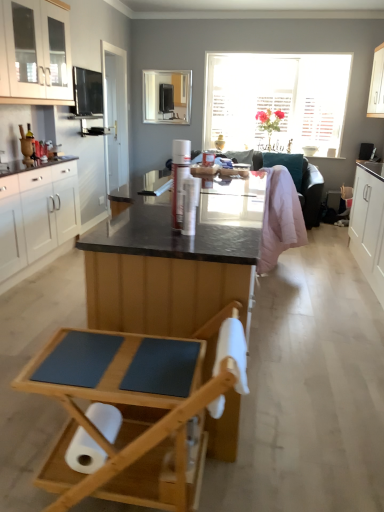
Question: Does white glossy cabinet at upper right, which is the fourth cabinetry from left to right, have a greater height compared to teal fabric couch at center?

Choices:
 (A) yes
 (B) no

Answer: (B)

Question: Is white glossy cabinet at upper right, which is the fourth cabinetry from left to right, at the right side of teal fabric couch at center?

Choices:
 (A) no
 (B) yes

Answer: (B)

Question: Is white glossy cabinet at upper right, the first cabinetry from the right, bigger than teal fabric couch at center?

Choices:
 (A) yes
 (B) no

Answer: (B)

Question: Is white glossy cabinet at upper right, which is the fourth cabinetry from left to right, not close to teal fabric couch at center?

Choices:
 (A) no
 (B) yes

Answer: (B)

Question: Is teal fabric couch at center surrounded by white glossy cabinet at upper right, the first cabinetry from the right?

Choices:
 (A) yes
 (B) no

Answer: (B)

Question: Is white glossy cabinet at upper right, the first cabinetry from the right, not inside teal fabric couch at center?

Choices:
 (A) no
 (B) yes

Answer: (B)

Question: Considering the relative sizes of white glossy cabinet at upper right, the first cabinetry from the right, and matte black tv at upper center in the image provided, is white glossy cabinet at upper right, the first cabinetry from the right, taller than matte black tv at upper center?

Choices:
 (A) no
 (B) yes

Answer: (B)

Question: From a real-world perspective, is white glossy cabinet at upper right, the first cabinetry from the right, positioned over matte black tv at upper center based on gravity?

Choices:
 (A) yes
 (B) no

Answer: (A)

Question: Is white glossy cabinet at upper right, the first cabinetry from the right, beside matte black tv at upper center?

Choices:
 (A) no
 (B) yes

Answer: (A)

Question: Is white glossy cabinet at upper right, which is the fourth cabinetry from left to right, not close to matte black tv at upper center?

Choices:
 (A) yes
 (B) no

Answer: (A)

Question: Can you confirm if white glossy cabinet at upper right, which is the fourth cabinetry from left to right, is smaller than matte black tv at upper center?

Choices:
 (A) no
 (B) yes

Answer: (A)

Question: Does white glossy cabinet at upper right, the first cabinetry from the right, appear on the left side of matte black tv at upper center?

Choices:
 (A) yes
 (B) no

Answer: (B)

Question: Does white glossy cabinets at upper left, which ranks as the third cabinetry in right-to-left order, have a lesser width compared to white glossy door at center?

Choices:
 (A) yes
 (B) no

Answer: (B)